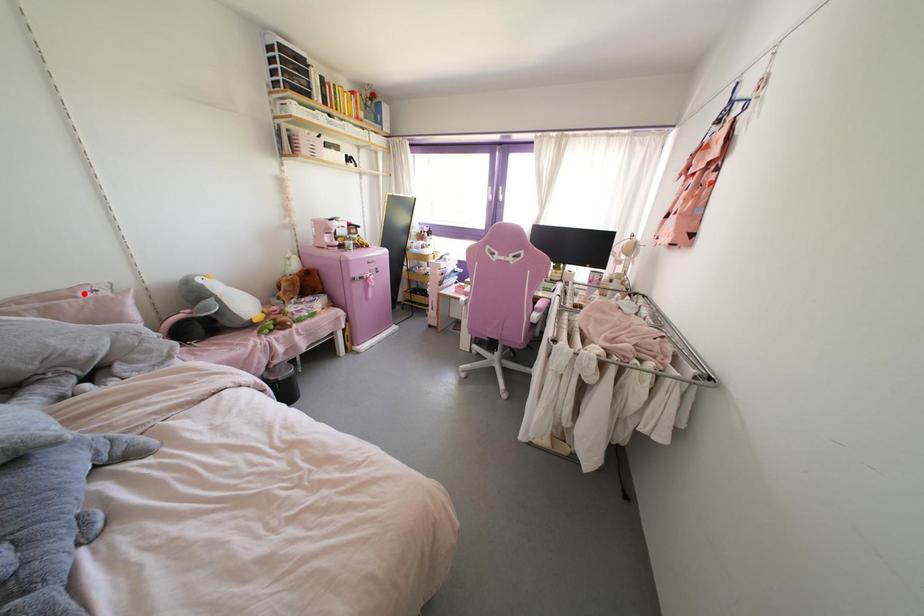
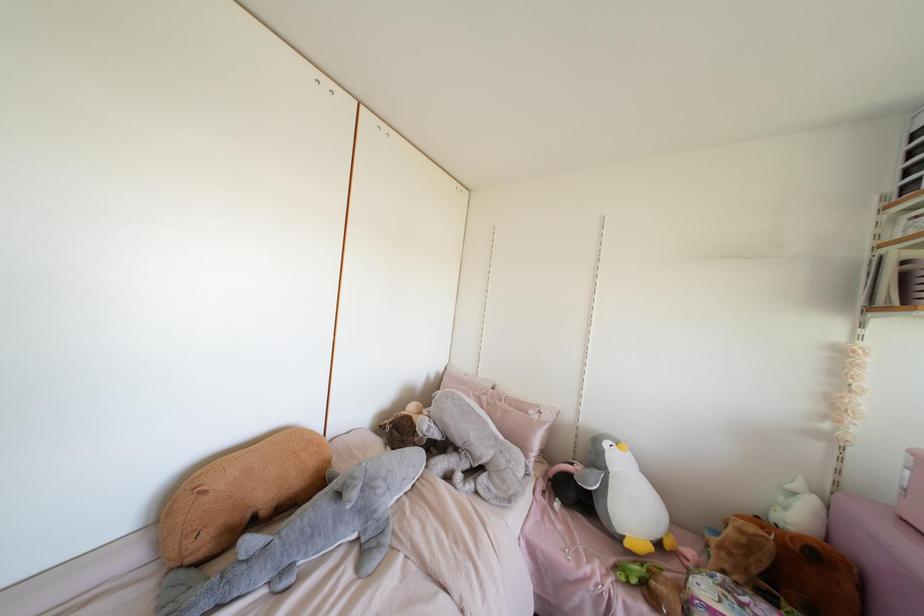
Where in the second image is the point corresponding to the highlighted location from the first image?

(530, 411)